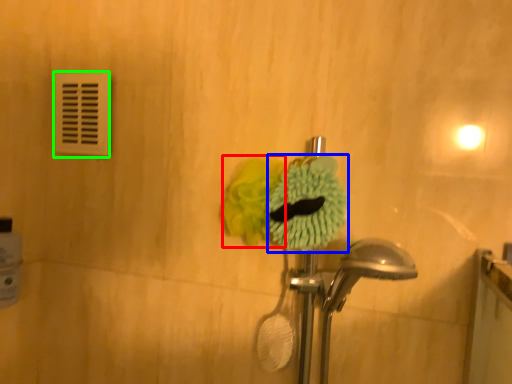
Question: Which object is positioned farthest from flower (highlighted by a red box)? Select from flower (highlighted by a blue box) and light switch (highlighted by a green box).

Choices:
 (A) flower
 (B) light switch

Answer: (B)